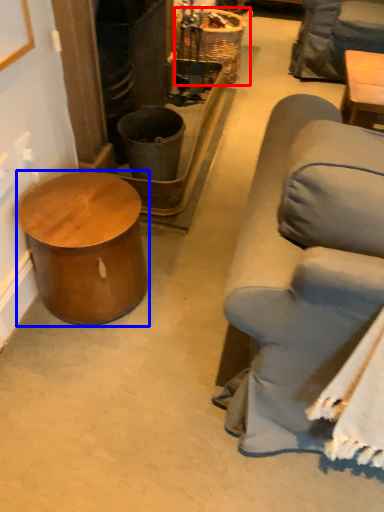
Question: Which of the following is the farthest to the observer, basket (highlighted by a red box) or table (highlighted by a blue box)?

Choices:
 (A) basket
 (B) table

Answer: (A)